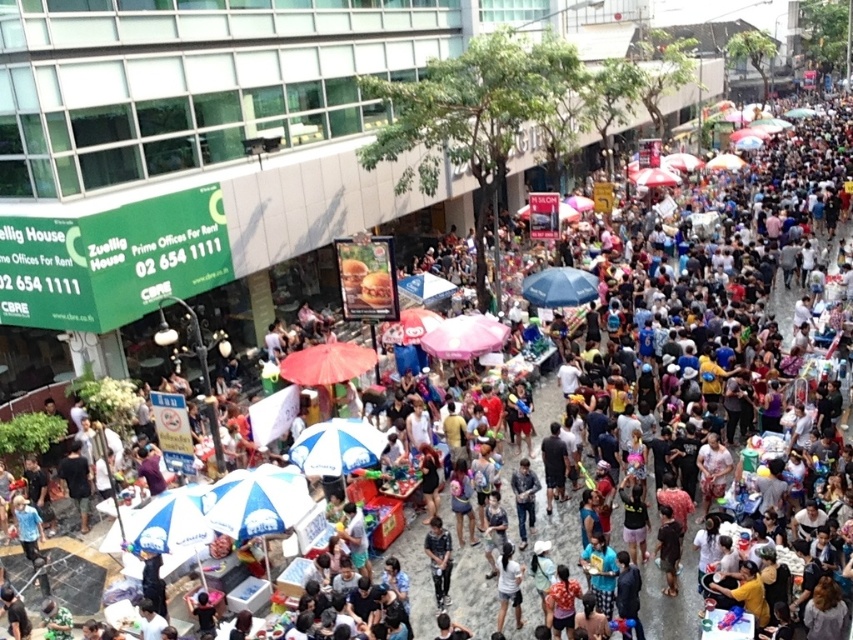
Question: Which of the following is the closest to the observer?

Choices:
 (A) (502, 602)
 (B) (525, 541)
 (C) (537, 276)
 (D) (311, 451)

Answer: (A)

Question: In this image, where is pink fabric umbrella at center located relative to blue fabric umbrella at center?

Choices:
 (A) right
 (B) left

Answer: (B)

Question: Among these objects, which one is nearest to the camera?

Choices:
 (A) dark gray fabric pants at center
 (B) white matte shirt at center

Answer: (B)

Question: Does blueumbrella at center have a greater width compared to dark gray fabric pants at center?

Choices:
 (A) no
 (B) yes

Answer: (B)

Question: Does blueumbrella at center have a larger size compared to white matte shirt at center?

Choices:
 (A) yes
 (B) no

Answer: (A)

Question: Which point is farther to the camera?

Choices:
 (A) [311, 444]
 (B) [503, 326]

Answer: (B)